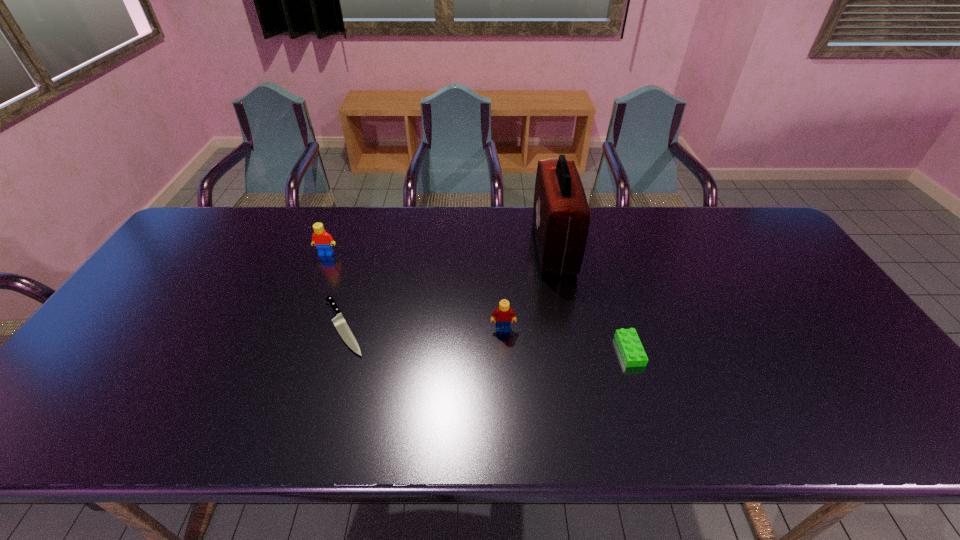
The image size is (960, 540). Identify the location of free region at the right edge of the desktop. (817, 312).

This screenshot has height=540, width=960. In the image, there is a desktop. Identify the location of vacant space at the far left corner. (225, 217).

Locate an element on the screen. This screenshot has width=960, height=540. vacant point at the near right corner is located at coordinates (908, 415).

You are a GUI agent. You are given a task and a screenshot of the screen. Output one action in this format:
    pyautogui.click(x=<x>, y=<y>)
    Task: Click on the vacant space that is in between the leftmost object and the fourth object from left to right
    This screenshot has height=540, width=960.
    Given the screenshot: What is the action you would take?
    pyautogui.click(x=440, y=250)

At what (x,y) coordinates should I click in order to perform the action: click on vacant space in between the second Lego from left to right and the fourth object from right to left. Please return your answer as a coordinate pair (x, y). This screenshot has width=960, height=540. Looking at the image, I should click on click(423, 328).

You are a GUI agent. You are given a task and a screenshot of the screen. Output one action in this format:
    pyautogui.click(x=<x>, y=<y>)
    Task: Click on the unoccupied area between the steak knife and the third object from left to right
    This screenshot has height=540, width=960.
    Given the screenshot: What is the action you would take?
    pyautogui.click(x=423, y=328)

You are a GUI agent. You are given a task and a screenshot of the screen. Output one action in this format:
    pyautogui.click(x=<x>, y=<y>)
    Task: Click on the empty space that is in between the leftmost object and the fourth tallest object
    
    Given the screenshot: What is the action you would take?
    pyautogui.click(x=478, y=302)

Locate an element on the screen. Image resolution: width=960 pixels, height=540 pixels. free space between the first aid kit and the leftmost object is located at coordinates click(440, 250).

Identify the location of free area in between the nearest Lego and the third object from right to left. Image resolution: width=960 pixels, height=540 pixels. (566, 340).

Locate an element on the screen. The height and width of the screenshot is (540, 960). free spot between the leftmost object and the steak knife is located at coordinates (335, 290).